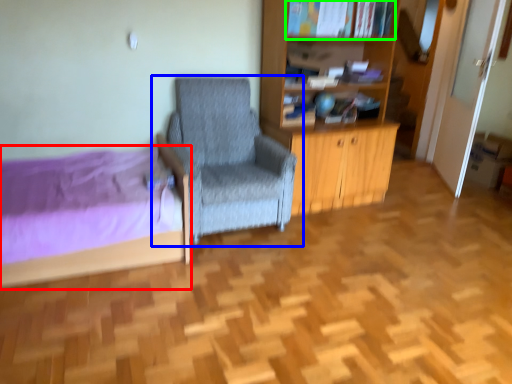
Question: Which is farther away from bed (highlighted by a red box)? chair (highlighted by a blue box) or book (highlighted by a green box)?

Choices:
 (A) chair
 (B) book

Answer: (B)